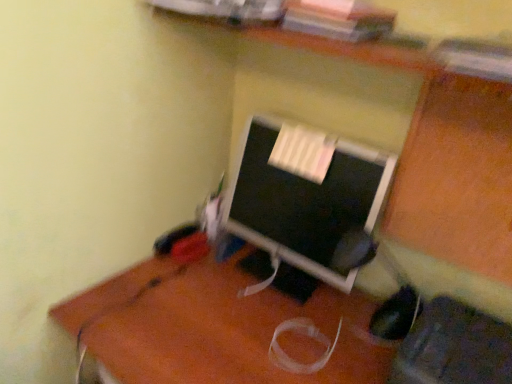
Question: Based on their sizes in the image, would you say black fabric computer chair at lower right is bigger or smaller than brown wooden desk at center?

Choices:
 (A) small
 (B) big

Answer: (A)

Question: From the image's perspective, relative to brown wooden desk at center, is black fabric computer chair at lower right above or below?

Choices:
 (A) below
 (B) above

Answer: (B)

Question: Estimate the real-world distances between objects in this image. Which object is farther from the matte black monitor at center?

Choices:
 (A) brown wooden desk at center
 (B) black fabric computer chair at lower right

Answer: (B)

Question: Considering the real-world distances, which object is farthest from the black fabric computer chair at lower right?

Choices:
 (A) brown wooden desk at center
 (B) matte black monitor at center

Answer: (B)